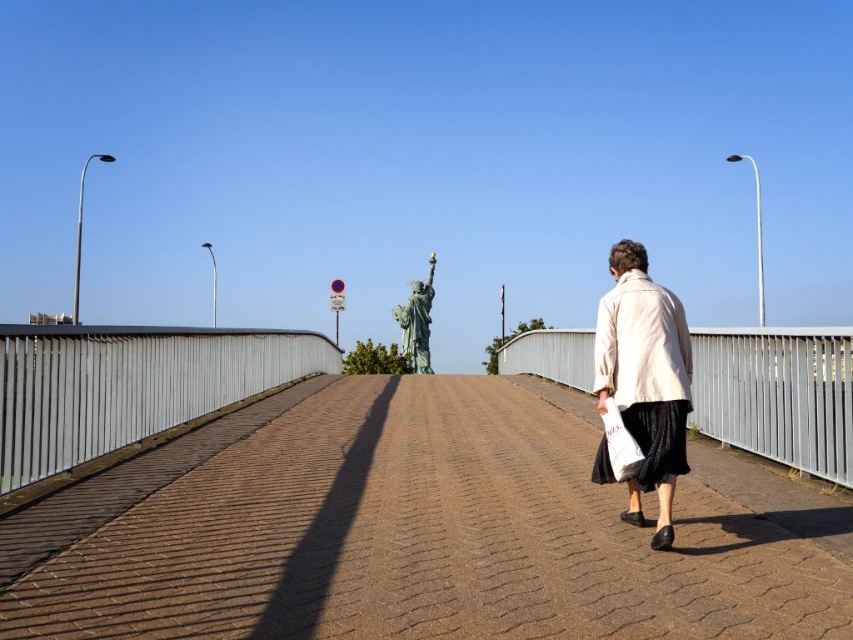
Which is more to the left, white metal rail at right or light beige fabric coat at right?

light beige fabric coat at right is more to the left.

Is white metal rail at right positioned behind light beige fabric coat at right?

Yes, white metal rail at right is behind light beige fabric coat at right.

What do you see at coordinates (776, 394) in the screenshot?
I see `white metal rail at right` at bounding box center [776, 394].

Identify the location of white metal rail at right. (776, 394).

Between silver metallic rail at left and white metal rail at right, which one has less height?

silver metallic rail at left is shorter.

Is point (102, 330) less distant than point (692, 400)?

Yes.

You are a GUI agent. You are given a task and a screenshot of the screen. Output one action in this format:
    pyautogui.click(x=<x>, y=<y>)
    Task: Click on the silver metallic rail at left
    The image size is (853, 640).
    Given the screenshot: What is the action you would take?
    pyautogui.click(x=129, y=385)

Can you confirm if brown textured pavement at center is bigger than silver metallic rail at left?

Indeed, brown textured pavement at center has a larger size compared to silver metallic rail at left.

Who is positioned more to the left, brown textured pavement at center or silver metallic rail at left?

silver metallic rail at left is more to the left.

Identify the location of brown textured pavement at center. This screenshot has width=853, height=640. (408, 532).

Locate an element on the screen. This screenshot has height=640, width=853. brown textured pavement at center is located at coordinates (408, 532).